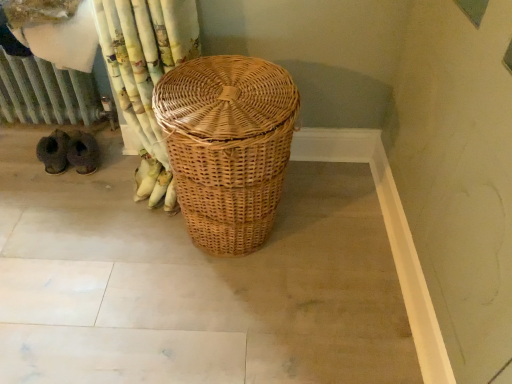
The image size is (512, 384). What are the coordinates of `natural wicker basket at center` in the screenshot? It's located at (227, 146).

What is the approximate width of natural wicker basket at center?

It is 49.25 centimeters.

Image resolution: width=512 pixels, height=384 pixels. What do you see at coordinates (227, 146) in the screenshot?
I see `natural wicker basket at center` at bounding box center [227, 146].

Consider the image. In order to face metallic radiator at left, should I rotate leftwards or rightwards?

You should rotate left by 27.417 degrees.

The width and height of the screenshot is (512, 384). What do you see at coordinates (46, 93) in the screenshot?
I see `metallic radiator at left` at bounding box center [46, 93].

Find the location of `metallic radiator at left`. metallic radiator at left is located at coordinates 46,93.

Find the location of a particular element. Image resolution: width=512 pixels, height=384 pixels. natural wicker basket at center is located at coordinates (227, 146).

Considering the positions of objects natural wicker basket at center and metallic radiator at left in the image provided, who is more to the right, natural wicker basket at center or metallic radiator at left?

natural wicker basket at center is more to the right.

Is natural wicker basket at center in front of metallic radiator at left?

Yes, natural wicker basket at center is closer to the camera.

Does point (276, 126) appear closer or farther from the camera than point (84, 93)?

Point (276, 126) appears to be closer to the viewer than point (84, 93).

From the image's perspective, is natural wicker basket at center above or below metallic radiator at left?

From the image's perspective, natural wicker basket at center appears below metallic radiator at left.

From a real-world perspective, who is located lower, natural wicker basket at center or metallic radiator at left?

In real-world perspective, metallic radiator at left is lower.

Consider the image. Is natural wicker basket at center thinner than metallic radiator at left?

Correct, the width of natural wicker basket at center is less than that of metallic radiator at left.

Between natural wicker basket at center and metallic radiator at left, which one has more height?

Standing taller between the two is natural wicker basket at center.

Who is bigger, natural wicker basket at center or metallic radiator at left?

Bigger between the two is natural wicker basket at center.

Is metallic radiator at left located within natural wicker basket at center?

No, metallic radiator at left is not a part of natural wicker basket at center.

Would you say natural wicker basket at center is a long distance from metallic radiator at left?

They are positioned close to each other.

Could you tell me if natural wicker basket at center is turned towards metallic radiator at left?

No, natural wicker basket at center is not turned towards metallic radiator at left.

How many degrees apart are the facing directions of natural wicker basket at center and metallic radiator at left?

90.3 degrees separate the facing orientations of natural wicker basket at center and metallic radiator at left.

Image resolution: width=512 pixels, height=384 pixels. I want to click on radiator beneath the natural wicker basket at center (from a real-world perspective), so click(46, 93).

From the picture: Does metallic radiator at left appear on the left side of natural wicker basket at center?

Yes, metallic radiator at left is to the left of natural wicker basket at center.

Is metallic radiator at left in front of or behind natural wicker basket at center in the image?

metallic radiator at left is positioned farther from the viewer than natural wicker basket at center.

Is point (7, 121) positioned before point (161, 82)?

No, (7, 121) is behind (161, 82).

Consider the image. From the image's perspective, is metallic radiator at left above or below natural wicker basket at center?

Based on their image positions, metallic radiator at left is located above natural wicker basket at center.

From a real-world perspective, is metallic radiator at left beneath natural wicker basket at center?

Correct, in the physical world, metallic radiator at left is lower than natural wicker basket at center.

From the picture: Does metallic radiator at left have a lesser width compared to natural wicker basket at center?

Incorrect, the width of metallic radiator at left is not less than that of natural wicker basket at center.

Is metallic radiator at left taller or shorter than natural wicker basket at center?

Considering their sizes, metallic radiator at left has less height than natural wicker basket at center.

Considering the relative sizes of metallic radiator at left and natural wicker basket at center in the image provided, is metallic radiator at left bigger than natural wicker basket at center?

Actually, metallic radiator at left might be smaller than natural wicker basket at center.

Which is correct: metallic radiator at left is inside natural wicker basket at center, or outside of it?

metallic radiator at left is not inside natural wicker basket at center, it's outside.

Is metallic radiator at left touching natural wicker basket at center?

No, metallic radiator at left is not next to natural wicker basket at center.

Could you tell me if metallic radiator at left is turned towards natural wicker basket at center?

No, metallic radiator at left is not turned towards natural wicker basket at center.

How many degrees apart are the facing directions of metallic radiator at left and natural wicker basket at center?

metallic radiator at left and natural wicker basket at center are facing 90.3 degrees away from each other.

Where is `picnic basket above the metallic radiator at left (from a real-world perspective)`? This screenshot has height=384, width=512. picnic basket above the metallic radiator at left (from a real-world perspective) is located at coordinates (227, 146).

Locate an element on the screen. radiator lying on the left of natural wicker basket at center is located at coordinates (46, 93).

You are a GUI agent. You are given a task and a screenshot of the screen. Output one action in this format:
    pyautogui.click(x=<x>, y=<y>)
    Task: Click on the picnic basket that appears in front of the metallic radiator at left
    
    Given the screenshot: What is the action you would take?
    pyautogui.click(x=227, y=146)